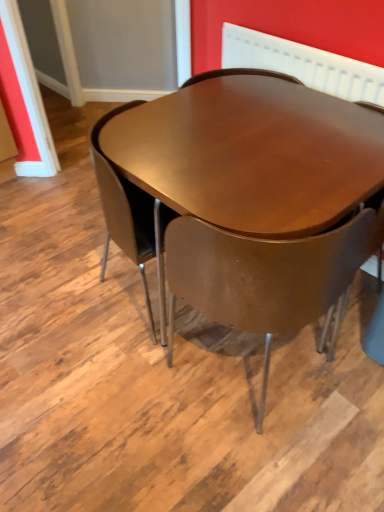
Image resolution: width=384 pixels, height=512 pixels. Identify the location of blank space to the left of shiny brown table at center. (67, 307).